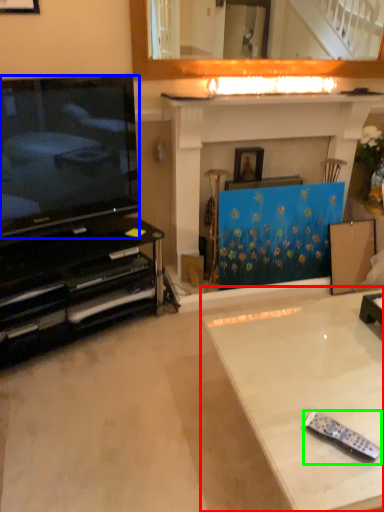
Question: Considering the real-world distances, which object is farthest from table (highlighted by a red box)? television (highlighted by a blue box) or remote control (highlighted by a green box)?

Choices:
 (A) television
 (B) remote control

Answer: (A)